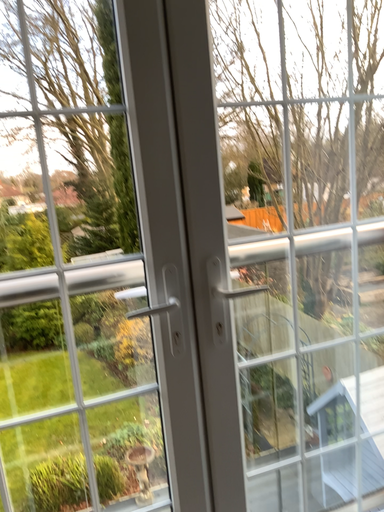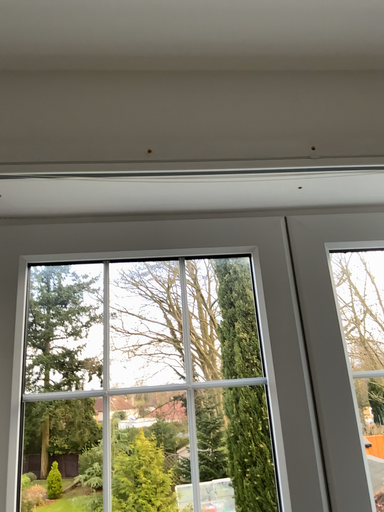
Question: How did the camera likely rotate when shooting the video?

Choices:
 (A) rotated left
 (B) rotated right

Answer: (A)